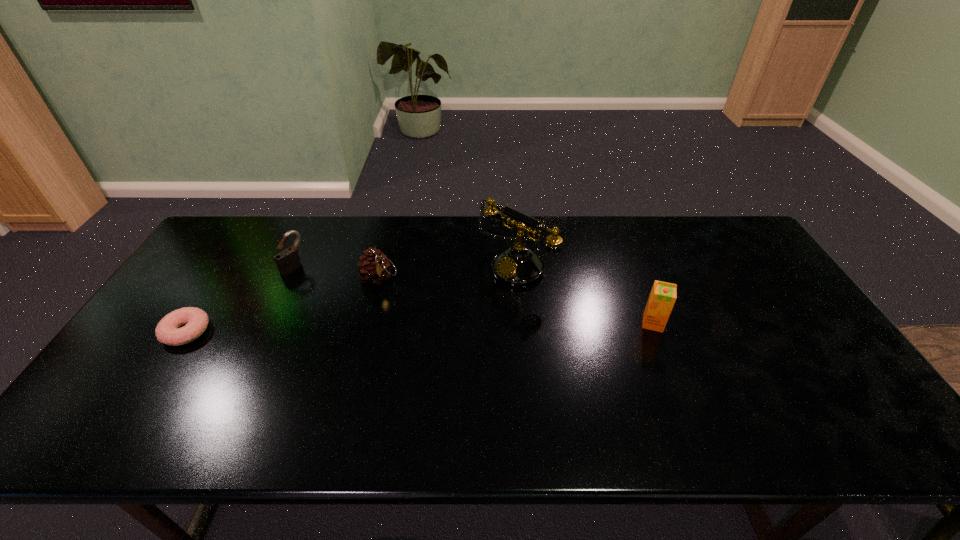
The image size is (960, 540). I want to click on the leftmost object, so click(x=168, y=332).

Where is `doughnut`? The image size is (960, 540). doughnut is located at coordinates (168, 332).

Locate an element on the screen. This screenshot has width=960, height=540. orange juice is located at coordinates (663, 295).

I want to click on the rightmost object, so click(x=663, y=295).

The width and height of the screenshot is (960, 540). Find the location of `the second object from left to right`. the second object from left to right is located at coordinates (288, 260).

At what (x,y) coordinates should I click in order to perform the action: click on the third object from left to right. Please return your answer as a coordinate pair (x, y). The height and width of the screenshot is (540, 960). Looking at the image, I should click on (375, 268).

Where is `the tallest object`? This screenshot has width=960, height=540. the tallest object is located at coordinates (517, 266).

You are a GUI agent. You are given a task and a screenshot of the screen. Output one action in this format:
    pyautogui.click(x=<x>, y=<y>)
    Task: Click on the second object from right to left
    This screenshot has width=960, height=540.
    Given the screenshot: What is the action you would take?
    pyautogui.click(x=517, y=266)

Locate an element on the screen. The height and width of the screenshot is (540, 960). free region located on the front of the doughnut is located at coordinates (152, 386).

Locate an element on the screen. free space located on the right of the fourth shortest object is located at coordinates (802, 323).